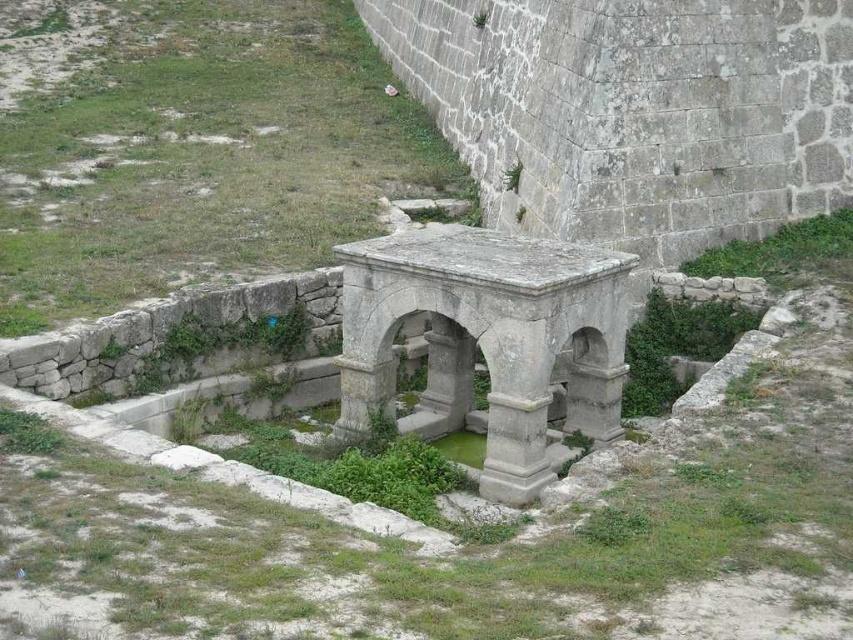
Question: Is gray stone fountain at center wider than gray stone column at center?

Choices:
 (A) no
 (B) yes

Answer: (B)

Question: Is gray stone fountain at center smaller than gray stone column at center?

Choices:
 (A) yes
 (B) no

Answer: (B)

Question: Observing the image, what is the correct spatial positioning of gray stone fountain at center in reference to gray stone column at center?

Choices:
 (A) below
 (B) above

Answer: (B)

Question: Among these points, which one is nearest to the camera?

Choices:
 (A) (544, 406)
 (B) (500, 403)

Answer: (B)

Question: Among these objects, which one is nearest to the camera?

Choices:
 (A) gray stone fountain at center
 (B) gray stone column at center

Answer: (A)